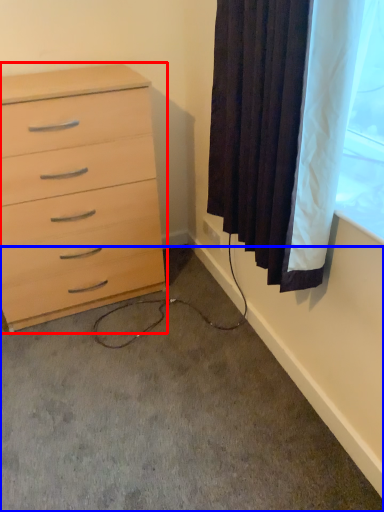
Question: Which of the following is the farthest to the observer, chest of drawers (highlighted by a red box) or concrete (highlighted by a blue box)?

Choices:
 (A) chest of drawers
 (B) concrete

Answer: (A)